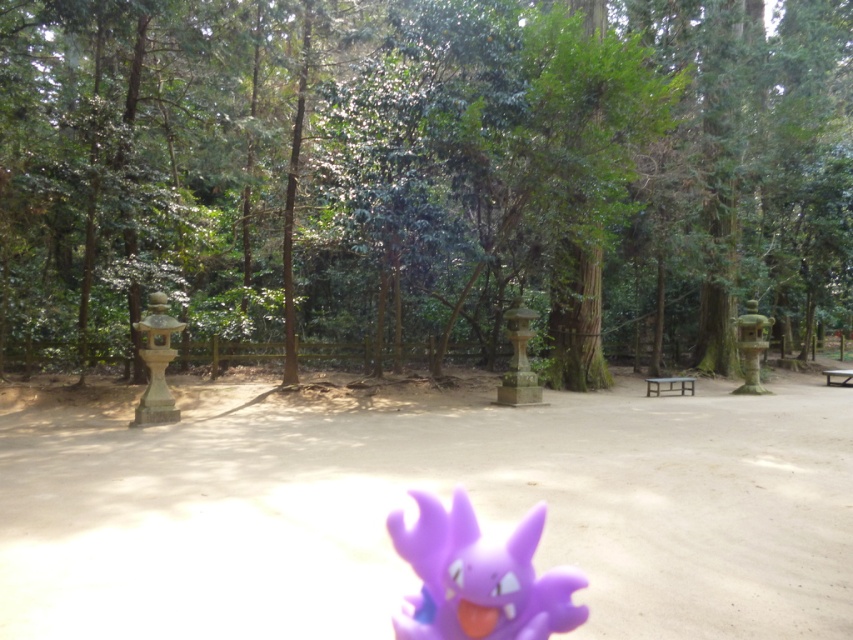
You are standing in the forest scene and want to walk from the point at coordinates point (x=747, y=312) to the point at coordinates point (x=840, y=372). Which direction should you move?

You should move forward because point (x=747, y=312) is behind point (x=840, y=372), so moving towards the latter requires going forward.

You are planning to place a narrow decorative vase next to the matte stone lantern at right and the wooden picnic table at center. Which object should you place it next to if you want it to fit better in terms of width?

The narrow decorative vase should be placed next to the matte stone lantern at right because it is thinner than the wooden picnic table at center, making it a better fit for the vase in terms of width.